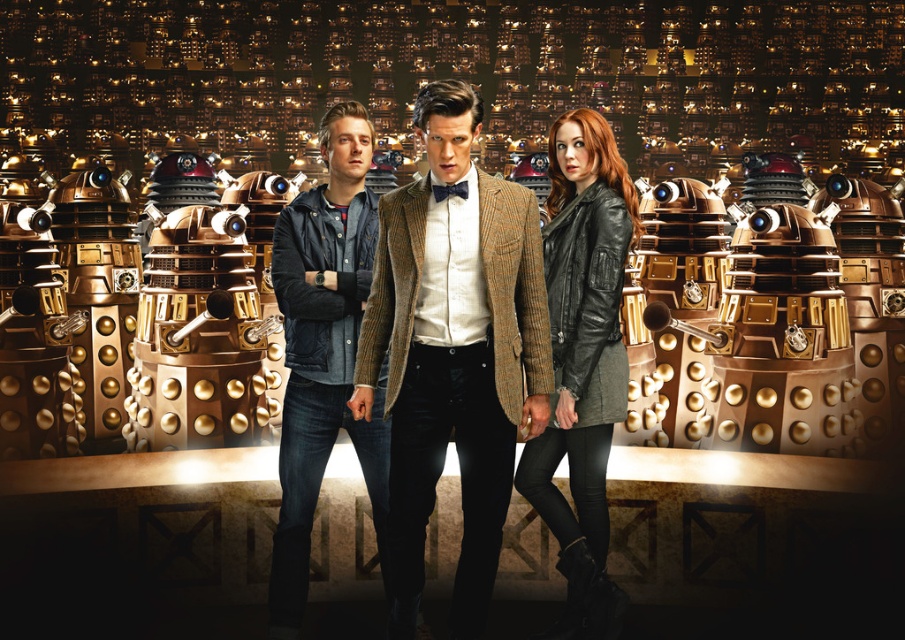
Which is more to the right, black leather jacket at center or denim jacket at center?

Positioned to the right is black leather jacket at center.

Is point (591, 144) positioned in front of point (301, 570)?

No, (591, 144) is behind (301, 570).

You are a GUI agent. You are given a task and a screenshot of the screen. Output one action in this format:
    pyautogui.click(x=<x>, y=<y>)
    Task: Click on the black leather jacket at center
    The height and width of the screenshot is (640, 905).
    Given the screenshot: What is the action you would take?
    pyautogui.click(x=582, y=362)

Can you confirm if brown corduroy blazer at center is taller than denim jacket at center?

No.

Is brown corduroy blazer at center wider than denim jacket at center?

Yes, brown corduroy blazer at center is wider than denim jacket at center.

Is point (469, 401) behind point (337, 353)?

No, (469, 401) is in front of (337, 353).

Locate an element on the screen. The image size is (905, 640). brown corduroy blazer at center is located at coordinates tap(453, 352).

Who is taller, brown corduroy blazer at center or black leather jacket at center?

With more height is brown corduroy blazer at center.

Can you confirm if brown corduroy blazer at center is positioned to the right of black leather jacket at center?

Incorrect, brown corduroy blazer at center is not on the right side of black leather jacket at center.

Is point (417, 227) positioned behind point (538, 504)?

That is True.

Find the location of a particular element. The image size is (905, 640). brown corduroy blazer at center is located at coordinates (453, 352).